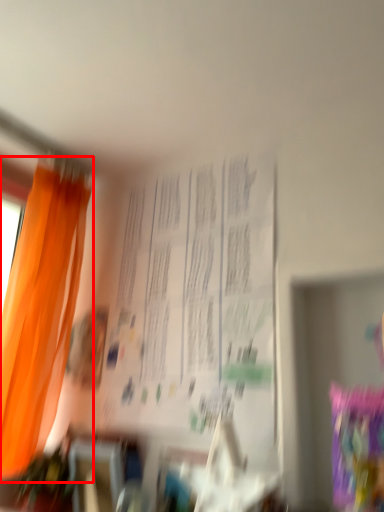
Question: From the image's perspective, what is the correct spatial relationship of curtain (annotated by the red box) in relation to bulletin board?

Choices:
 (A) below
 (B) above

Answer: (A)